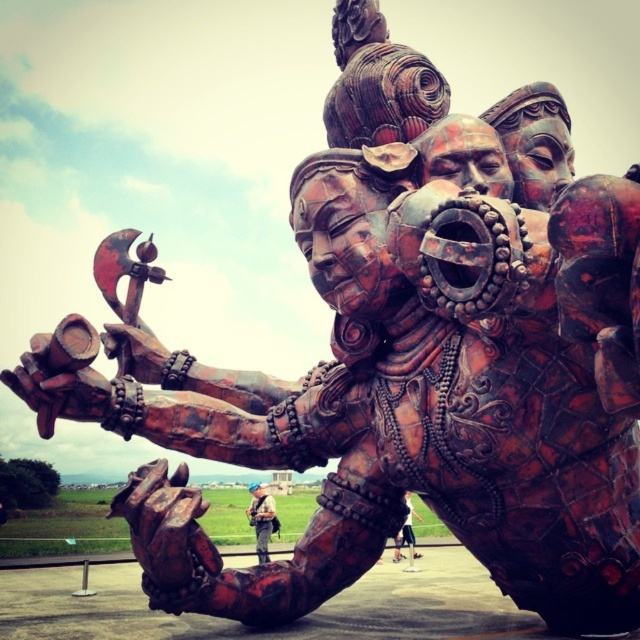
In the scene shown: Is metallic helmet at center to the right of matte brown leather jacket at lower center from the viewer's perspective?

Incorrect, metallic helmet at center is not on the right side of matte brown leather jacket at lower center.

Is metallic helmet at center positioned at the back of matte brown leather jacket at lower center?

Yes, it is behind matte brown leather jacket at lower center.

Which is behind, point (268, 499) or point (410, 522)?

The point (410, 522) is behind.

Locate an element on the screen. metallic helmet at center is located at coordinates (260, 518).